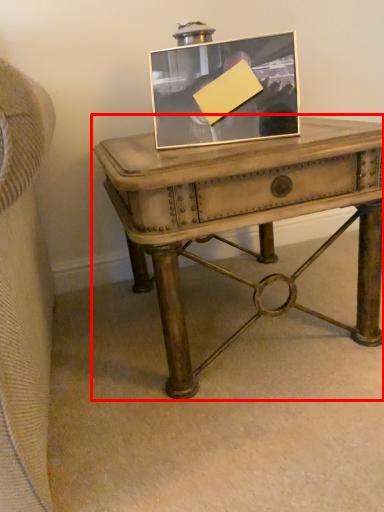
Question: In this image, where is table (annotated by the red box) located relative to picture frame?

Choices:
 (A) left
 (B) right

Answer: (B)